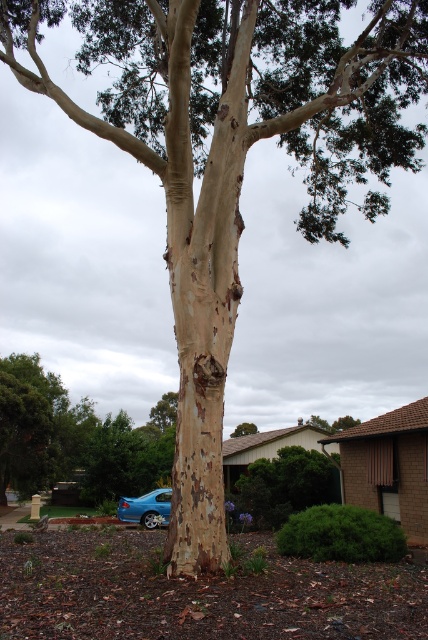
Locate an element on the screen. blue metallic sedan at lower left is located at coordinates (145, 508).